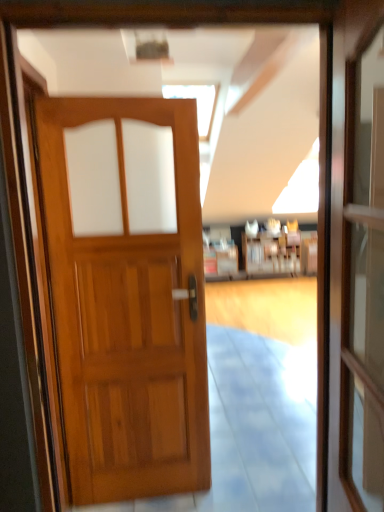
This screenshot has width=384, height=512. Describe the element at coordinates (357, 269) in the screenshot. I see `transparent glass screen door at right` at that location.

In order to click on wooden door at center in this screenshot , I will do `click(129, 320)`.

In the scene shown: Considering the sizes of objects wooden door at center and transparent glass screen door at right in the image provided, who is taller, wooden door at center or transparent glass screen door at right?

With more height is wooden door at center.

Looking at their sizes, would you say wooden door at center is wider or thinner than transparent glass screen door at right?

Clearly, wooden door at center has more width compared to transparent glass screen door at right.

Does point (124, 474) lie behind point (365, 439)?

Yes, it is.

Considering the relative positions of wooden door at center and transparent glass screen door at right in the image provided, is wooden door at center to the left or to the right of transparent glass screen door at right?

wooden door at center is to the left of transparent glass screen door at right.

Find the location of a particular element. Image resolution: width=384 pixels, height=512 pixels. hotel lobby above the wooden door at center (from the image's perspective) is located at coordinates (264, 254).

From a real-world perspective, between wooden door at center and wooden bookshelf at center, who is vertically lower?

wooden bookshelf at center.

From the image's perspective, which is below, wooden door at center or wooden bookshelf at center?

wooden door at center.

Is transparent glass screen door at right touching wooden door at center?

No, transparent glass screen door at right is not touching wooden door at center.

Identify the location of door that appears below the transparent glass screen door at right (from the image's perspective). (129, 320).

Is transparent glass screen door at right oriented away from wooden door at center?

No.

Does transparent glass screen door at right have a lesser width compared to wooden door at center?

Yes, transparent glass screen door at right is thinner than wooden door at center.

Which is behind, point (208, 278) or point (164, 435)?

The point (208, 278) is farther.

Considering the relative positions of wooden bookshelf at center and wooden door at center in the image provided, is wooden bookshelf at center to the right of wooden door at center from the viewer's perspective?

Yes, wooden bookshelf at center is to the right of wooden door at center.

Would you say wooden bookshelf at center is outside wooden door at center?

Yes, wooden bookshelf at center is outside of wooden door at center.

From a real-world perspective, relative to wooden door at center, is wooden bookshelf at center vertically above or below?

In terms of real-world spatial position, wooden bookshelf at center is below wooden door at center.

Considering the relative positions of transparent glass screen door at right and wooden bookshelf at center in the image provided, is transparent glass screen door at right to the right of wooden bookshelf at center from the viewer's perspective?

Incorrect, transparent glass screen door at right is not on the right side of wooden bookshelf at center.

Considering the sizes of objects transparent glass screen door at right and wooden bookshelf at center in the image provided, who is taller, transparent glass screen door at right or wooden bookshelf at center?

transparent glass screen door at right.

Is transparent glass screen door at right bigger than wooden bookshelf at center?

No, transparent glass screen door at right is not bigger than wooden bookshelf at center.

Between wooden bookshelf at center and transparent glass screen door at right, which one has smaller size?

transparent glass screen door at right.

Is wooden bookshelf at center turned away from transparent glass screen door at right?

wooden bookshelf at center does not have its back to transparent glass screen door at right.

Identify the location of hotel lobby directly beneath the transparent glass screen door at right (from a real-world perspective). The width and height of the screenshot is (384, 512). (264, 254).

Locate an element on the screen. This screenshot has height=512, width=384. screen door located above the wooden door at center (from a real-world perspective) is located at coordinates (357, 269).

This screenshot has height=512, width=384. Identify the location of hotel lobby that is above the wooden door at center (from the image's perspective). (264, 254).

Which object lies nearer to the anchor point transparent glass screen door at right, wooden door at center or wooden bookshelf at center?

wooden door at center lies closer to transparent glass screen door at right than the other object.

From the image, which object appears to be farther from wooden bookshelf at center, wooden door at center or transparent glass screen door at right?

The object further to wooden bookshelf at center is transparent glass screen door at right.

Which object lies further to the anchor point transparent glass screen door at right, wooden bookshelf at center or wooden door at center?

Based on the image, wooden bookshelf at center appears to be further to transparent glass screen door at right.

Which object lies nearer to the anchor point wooden door at center, transparent glass screen door at right or wooden bookshelf at center?

transparent glass screen door at right lies closer to wooden door at center than the other object.

Looking at the image, which one is located closer to wooden door at center, wooden bookshelf at center or transparent glass screen door at right?

transparent glass screen door at right is positioned closer to the anchor wooden door at center.

Looking at the image, which one is located further to wooden bookshelf at center, transparent glass screen door at right or wooden door at center?

Among the two, transparent glass screen door at right is located further to wooden bookshelf at center.

Locate an element on the screen. This screenshot has height=512, width=384. door between transparent glass screen door at right and wooden bookshelf at center along the z-axis is located at coordinates (129, 320).